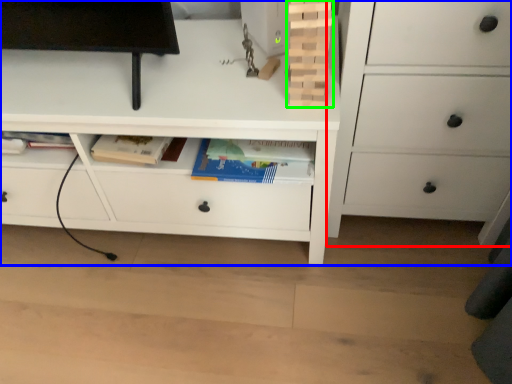
Question: Which is nearer to the chest of drawers (highlighted by a red box)? chest of drawers (highlighted by a blue box) or book (highlighted by a green box).

Choices:
 (A) chest of drawers
 (B) book

Answer: (A)